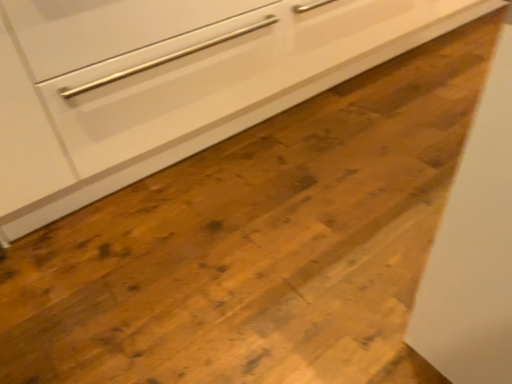
Where is `matte white cabinet at upper left`? The width and height of the screenshot is (512, 384). matte white cabinet at upper left is located at coordinates (189, 96).

What is the approximate height of matte white cabinet at upper left?

matte white cabinet at upper left is 2.11 inches in height.

The width and height of the screenshot is (512, 384). Describe the element at coordinates (189, 96) in the screenshot. I see `matte white cabinet at upper left` at that location.

The width and height of the screenshot is (512, 384). In order to click on matte white cabinet at upper left in this screenshot , I will do click(189, 96).